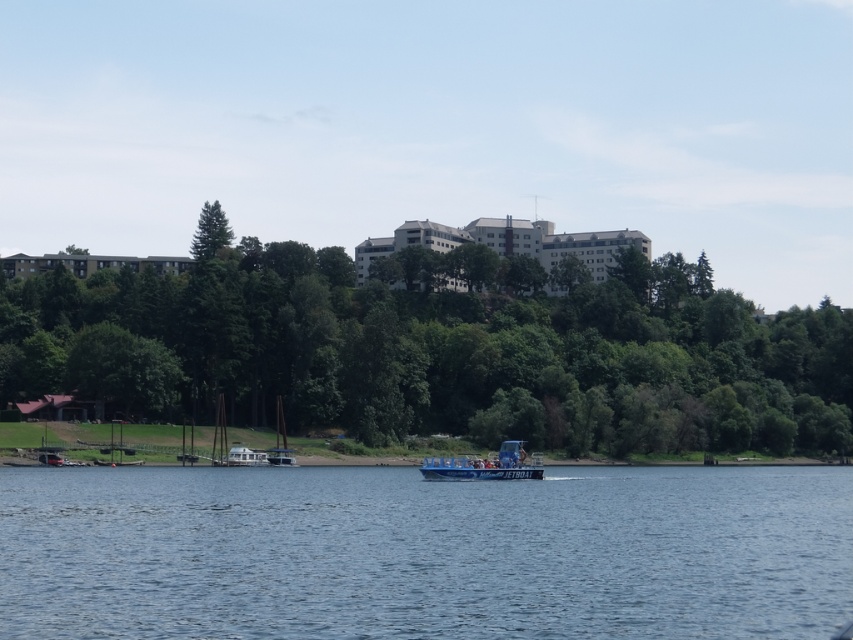
You are a photographer planning to take a photo of the blue plastic boat at center and the green matte tree at upper left. Which object should you focus on first if you want to capture both in the same frame without moving the camera?

You should focus on the blue plastic boat at center first because it is closer to the camera than the green matte tree at upper left, which is further away.

You are a passenger on the blue plastic boat at center. You notice the blue water at center above you. What does this indicate about your current situation?

The blue water at center being positioned over the blue plastic boat at center means that the boat is submerged in the water, which is normal for a boat floating on water.

You are a tourist planning to take a photo of the blue plastic boat at center and the blue water at center from the riverside. Which object should you focus on first if you want to capture both in the same frame without moving the camera?

You should focus on the blue plastic boat at center first because the blue water at center is positioned to its right, so framing the boat first allows the water to naturally fit into the right side of the frame.